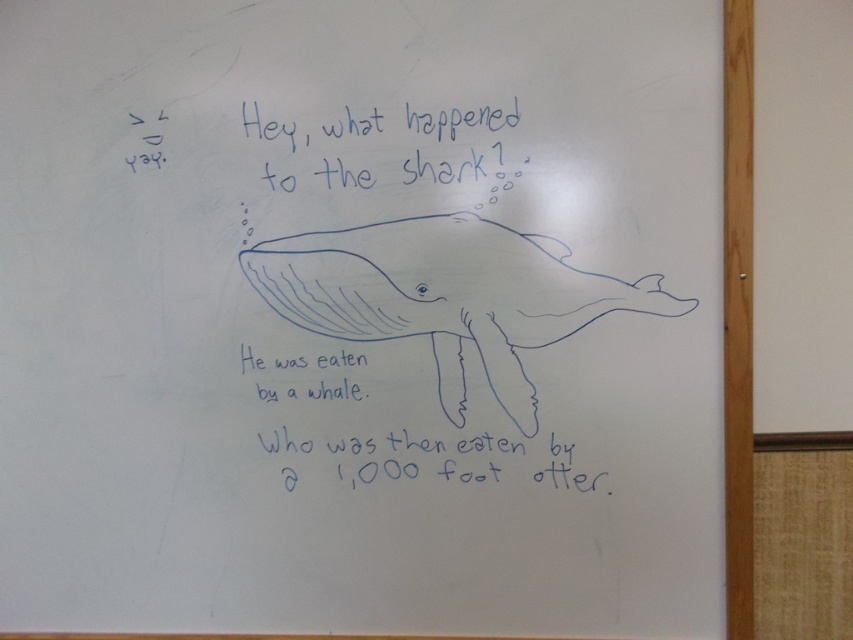
Question: Considering the real-world distances, which object is closest to the blue ink text at center?

Choices:
 (A) blue line drawing whale at center
 (B) blue handwritten text at upper center

Answer: (A)

Question: Which point is farther to the camera?

Choices:
 (A) (413, 113)
 (B) (401, 392)
 (C) (393, 291)

Answer: (B)

Question: Does blue line drawing whale at center have a smaller size compared to blue ink text at center?

Choices:
 (A) yes
 (B) no

Answer: (B)

Question: Based on their relative distances, which object is nearer to the blue handwritten text at upper center?

Choices:
 (A) blue ink text at center
 (B) blue line drawing whale at center

Answer: (B)

Question: Considering the relative positions of blue ink text at center and blue handwritten text at upper center in the image provided, where is blue ink text at center located with respect to blue handwritten text at upper center?

Choices:
 (A) above
 (B) below

Answer: (B)

Question: Does blue ink text at center appear over blue handwritten text at upper center?

Choices:
 (A) no
 (B) yes

Answer: (A)